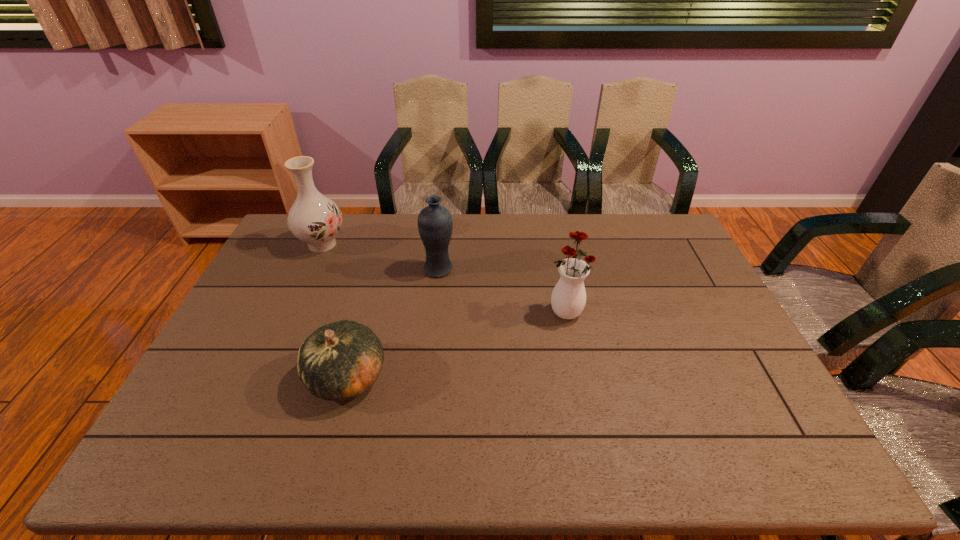
Identify the location of blank region between the second object from right to left and the shortest object. (393, 323).

Where is `vacant area between the leftmost object and the third object from left to right`? vacant area between the leftmost object and the third object from left to right is located at coordinates (380, 256).

This screenshot has height=540, width=960. Identify the location of free space between the third object from right to left and the third object from left to right. (393, 323).

Identify the location of free space between the second object from right to left and the rightmost object. The height and width of the screenshot is (540, 960). (502, 291).

Find the location of a particular element. The height and width of the screenshot is (540, 960). vacant region between the tallest vase and the rightmost vase is located at coordinates (444, 278).

At what (x,y) coordinates should I click in order to perform the action: click on free space that is in between the second object from right to left and the leftmost object. Please return your answer as a coordinate pair (x, y). Image resolution: width=960 pixels, height=540 pixels. Looking at the image, I should click on (380, 256).

Locate an element on the screen. The image size is (960, 540). free space between the rightmost object and the leftmost vase is located at coordinates (444, 278).

In order to click on empty location between the leftmost object and the rightmost vase in this screenshot , I will do `click(444, 278)`.

Identify which object is the third closest to the tallest object. Please provide its 2D coordinates. Your answer should be formatted as a tuple, i.e. [(x, y)], where the tuple contains the x and y coordinates of a point satisfying the conditions above.

[(568, 299)]

The image size is (960, 540). Identify the location of the closest object to the second vase from left to right. (339, 361).